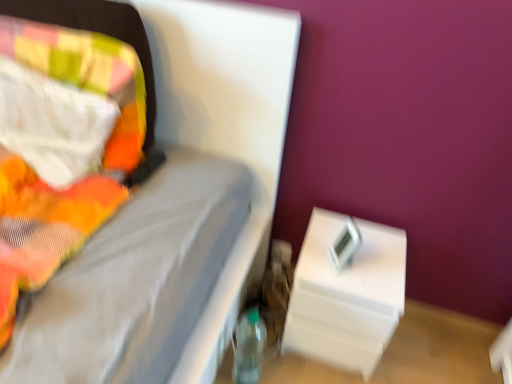
Image resolution: width=512 pixels, height=384 pixels. I want to click on free space above white plastic nightstand at lower right (from a real-world perspective), so click(360, 263).